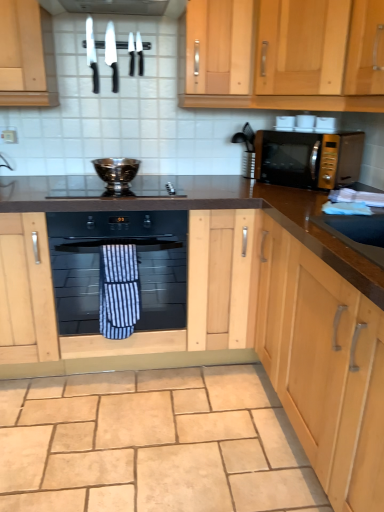
The height and width of the screenshot is (512, 384). I want to click on empty space that is ontop of beige stone floor at lower center (from a real-world perspective), so click(136, 430).